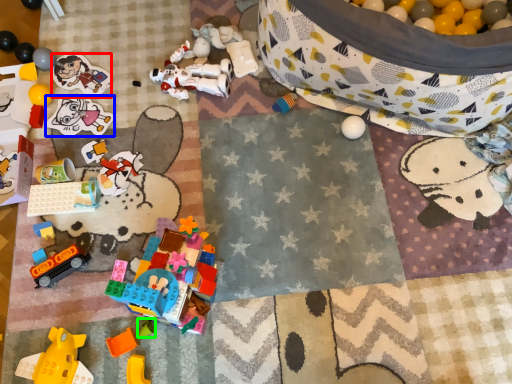
Question: Considering the real-world distances, which object is closest to toy (highlighted by a red box)? toy (highlighted by a blue box) or toy (highlighted by a green box).

Choices:
 (A) toy
 (B) toy

Answer: (A)